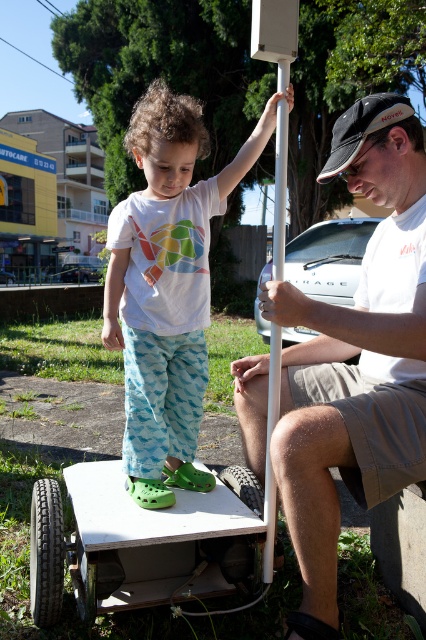
You are a photographer trying to capture the child in the scene. The white matte pole at center is blocking your view of the white cotton shirt at center. Can you move the pole to the side so you can see the shirt better?

The white matte pole at center is closer to the viewer than the white cotton shirt at center, so moving the pole would allow the photographer to see the white cotton shirt at center without obstruction.

You are a photographer trying to capture a photo of the white matte pole at center and the white cotton shirt at center. If you want to frame both objects in the same shot, which object should you focus on first to ensure both are in the frame?

The white matte pole at center has a smaller width than the white cotton shirt at center, so you should focus on the white cotton shirt at center first to ensure both objects are in the frame.